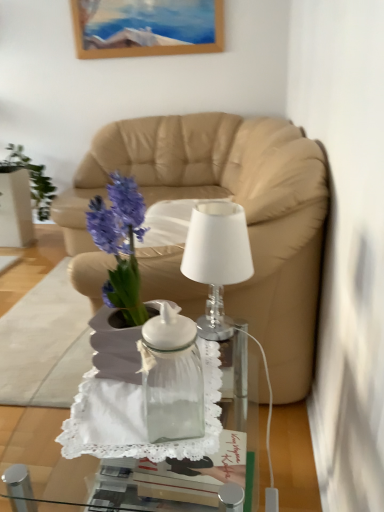
Identify the location of beige leather couch at center. Image resolution: width=384 pixels, height=512 pixels. (234, 200).

Is white glass lamp at center thinner than transparent glass jar at center?

Yes, white glass lamp at center is thinner than transparent glass jar at center.

Based on their positions, is white glass lamp at center located to the left or right of transparent glass jar at center?

In the image, white glass lamp at center appears on the right side of transparent glass jar at center.

Can you confirm if white glass lamp at center is shorter than transparent glass jar at center?

Indeed, white glass lamp at center has a lesser height compared to transparent glass jar at center.

Is transparent glass vase at center oriented towards transparent glass jar at center?

No, transparent glass vase at center is not aimed at transparent glass jar at center.

In the scene shown: Is transparent glass vase at center not close to transparent glass jar at center?

That's not correct — transparent glass vase at center is a little close to transparent glass jar at center.

Is transparent glass vase at center located outside transparent glass jar at center?

Absolutely, transparent glass vase at center is external to transparent glass jar at center.

Between beige leather couch at center and transparent glass jar at center, which one has more height?

beige leather couch at center is taller.

Where is `desk below the beige leather couch at center (from the image's perspective)`? desk below the beige leather couch at center (from the image's perspective) is located at coordinates (122, 447).

Would you say beige leather couch at center is outside transparent glass jar at center?

That's correct, beige leather couch at center is outside of transparent glass jar at center.

Is beige leather couch at center far away from transparent glass jar at center?

Yes, beige leather couch at center and transparent glass jar at center are located far from each other.

Does transparent glass vase at center lie in front of white glass lamp at center?

Yes, it is in front of white glass lamp at center.

Is transparent glass vase at center positioned with its back to white glass lamp at center?

transparent glass vase at center does not have its back to white glass lamp at center.

Which is in front, point (166, 375) or point (229, 217)?

Point (166, 375)

From the image's perspective, who appears lower, transparent glass vase at center or white glass lamp at center?

transparent glass vase at center is shown below in the image.

Measure the distance between white glass lamp at center and beige leather couch at center.

white glass lamp at center is 1.60 meters away from beige leather couch at center.

Which is closer, (213, 209) or (280, 374)?

Point (213, 209)

In the image, is white glass lamp at center positioned in front of or behind beige leather couch at center?

white glass lamp at center is in front of beige leather couch at center.

In the image, is white glass lamp at center positioned in front of or behind transparent glass vase at center?

Clearly, white glass lamp at center is behind transparent glass vase at center.

Can you tell me how much white glass lamp at center and transparent glass vase at center differ in facing direction?

The facing directions of white glass lamp at center and transparent glass vase at center are 13.1 degrees apart.

At what (x,y) coordinates should I click in order to perform the action: click on vase on the left of the white glass lamp at center. Please return your answer as a coordinate pair (x, y). The image size is (384, 512). Looking at the image, I should click on (171, 377).

Considering the sizes of objects beige leather couch at center and transparent glass vase at center in the image provided, who is bigger, beige leather couch at center or transparent glass vase at center?

Bigger between the two is beige leather couch at center.

Is beige leather couch at center not near transparent glass vase at center?

Absolutely, beige leather couch at center is distant from transparent glass vase at center.

Which object is closer to the camera taking this photo, beige leather couch at center or transparent glass vase at center?

transparent glass vase at center is more forward.

Visually, is beige leather couch at center positioned to the left or to the right of transparent glass vase at center?

Based on their positions, beige leather couch at center is located to the left of transparent glass vase at center.

I want to click on lamp that appears above the transparent glass jar at center (from a real-world perspective), so click(x=217, y=259).

The height and width of the screenshot is (512, 384). Find the location of `desk that appears in front of the transparent glass vase at center`. desk that appears in front of the transparent glass vase at center is located at coordinates (122, 447).

From the picture: Based on their spatial positions, is white glass lamp at center or transparent glass vase at center further from beige leather couch at center?

transparent glass vase at center lies further to beige leather couch at center than the other object.

Considering their positions, is transparent glass vase at center positioned closer to white glass lamp at center than beige leather couch at center?

transparent glass vase at center is positioned closer to the anchor white glass lamp at center.

Looking at the image, which one is located closer to transparent glass vase at center, beige leather couch at center or white glass lamp at center?

white glass lamp at center lies closer to transparent glass vase at center than the other object.

Based on their spatial positions, is beige leather couch at center or white glass lamp at center further from transparent glass jar at center?

beige leather couch at center is further to transparent glass jar at center.

Looking at the image, which one is located closer to white glass lamp at center, transparent glass vase at center or transparent glass jar at center?

Based on the image, transparent glass jar at center appears to be nearer to white glass lamp at center.

Looking at the image, which one is located further to white glass lamp at center, beige leather couch at center or transparent glass vase at center?

beige leather couch at center.

Which object lies nearer to the anchor point transparent glass jar at center, transparent glass vase at center or beige leather couch at center?

Based on the image, transparent glass vase at center appears to be nearer to transparent glass jar at center.

When comparing their distances from beige leather couch at center, does transparent glass vase at center or white glass lamp at center seem further?

Among the two, transparent glass vase at center is located further to beige leather couch at center.

Identify the location of vase between white glass lamp at center and transparent glass jar at center in the up-down direction. (171, 377).

At what (x,y) coordinates should I click in order to perform the action: click on lamp between beige leather couch at center and transparent glass vase at center from top to bottom. Please return your answer as a coordinate pair (x, y). The image size is (384, 512). Looking at the image, I should click on (217, 259).

Image resolution: width=384 pixels, height=512 pixels. In order to click on vase that lies between beige leather couch at center and transparent glass jar at center from top to bottom in this screenshot , I will do `click(171, 377)`.

Identify the location of lamp between beige leather couch at center and transparent glass jar at center vertically. This screenshot has width=384, height=512. (217, 259).